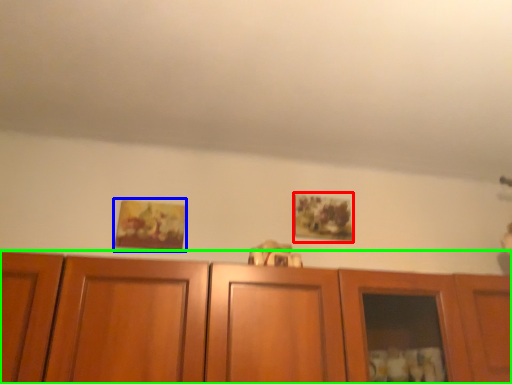
Question: Estimate the real-world distances between objects in this image. Which object is farther from picture frame (highlighted by a red box), picture frame (highlighted by a blue box) or cabinetry (highlighted by a green box)?

Choices:
 (A) picture frame
 (B) cabinetry

Answer: (A)